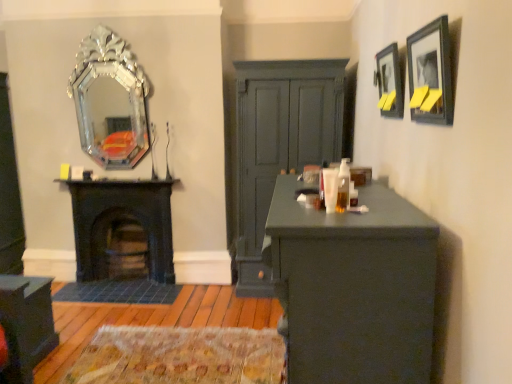
Question: Which is correct: matte black cabinet at lower left is inside matte black picture frame at upper right, which appears as the 2th picture frame when viewed from the back, or outside of it?

Choices:
 (A) inside
 (B) outside

Answer: (B)

Question: Considering the relative positions of matte black cabinet at lower left and matte black picture frame at upper right, which appears as the 2th picture frame when viewed from the back, in the image provided, is matte black cabinet at lower left to the left or to the right of matte black picture frame at upper right, which appears as the 2th picture frame when viewed from the back,?

Choices:
 (A) right
 (B) left

Answer: (B)

Question: Considering the real-world distances, which object is closest to the matte dark green desk at center?

Choices:
 (A) matte black cabinet at lower left
 (B) matte dark green dresser at center
 (C) matte black picture frame at upper right, placed as the first picture frame when sorted from back to front
 (D) matte black picture frame at upper right, the 1th picture frame in the front-to-back sequence
 (E) silver metallic mirror at upper left

Answer: (D)

Question: Which is farther from the silver metallic mirror at upper left?

Choices:
 (A) matte black picture frame at upper right, the 1th picture frame in the front-to-back sequence
 (B) matte dark green dresser at center
 (C) black cast iron fireplace at left
 (D) matte black picture frame at upper right, which appears as the 2th picture frame when viewed from the front
 (E) matte black cabinet at lower left

Answer: (A)